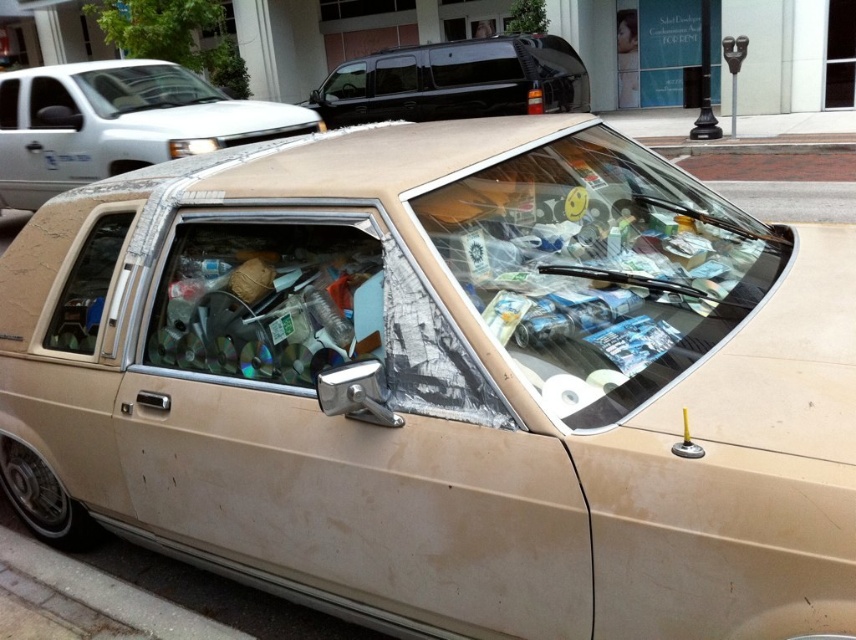
You are a delivery person trying to park your van in a parking lot. You see the beige matte car at center and the black glossy minivan at upper center. Which vehicle is positioned lower in the scene?

The beige matte car at center is positioned below the black glossy minivan at upper center, so the beige matte car at center is lower in the scene.